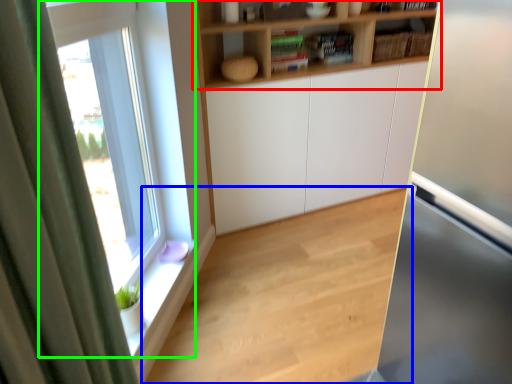
Question: Which is farther away from shelf (highlighted by a red box)? hardwood (highlighted by a blue box) or window (highlighted by a green box)?

Choices:
 (A) hardwood
 (B) window

Answer: (A)